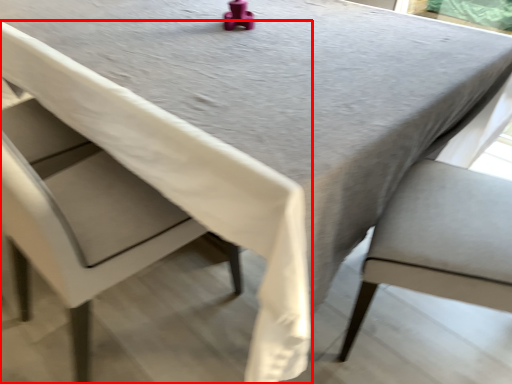
Question: From the image's perspective, what is the correct spatial positioning of chair (annotated by the red box) in reference to chair?

Choices:
 (A) above
 (B) below

Answer: (A)